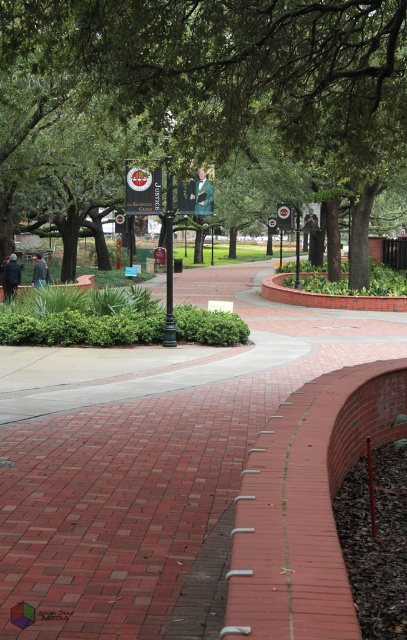
From the picture: You are a gardener who needs to mow the red brick pathway at center and the green leafy tree at center. Which area requires a wider path for the lawnmower?

The green leafy tree at center requires a wider path for the lawnmower because the red brick pathway at center is thinner than the green leafy tree at center.

You are a pedestrian walking along the red brick pathway at center. You want to reach the green leafy tree at center. Which direction should you walk to get closer to the tree?

The red brick pathway at center is in front of green leafy tree at center, so you should walk forward along the red brick pathway at center to get closer to the green leafy tree at center.